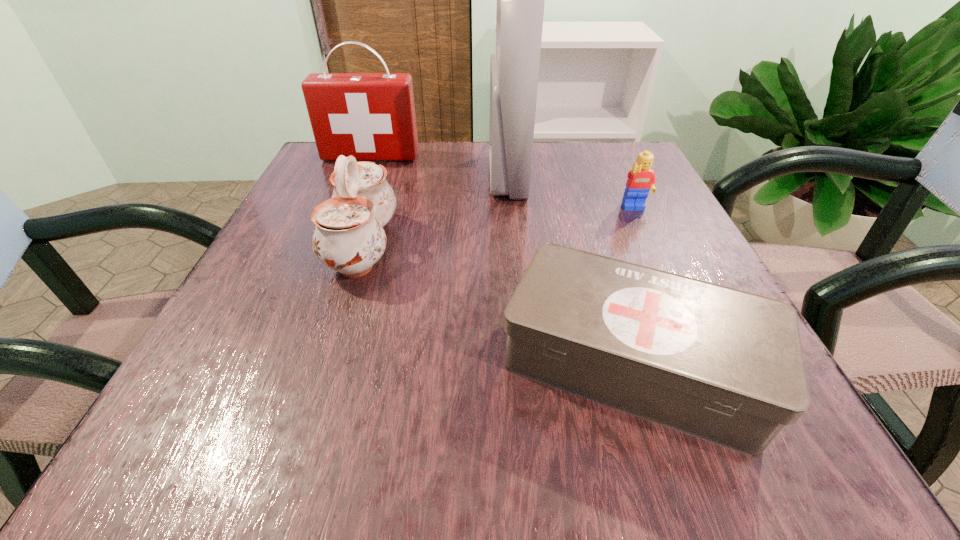
Find the location of a particular element. The image size is (960, 540). object positioned at the near right corner is located at coordinates (724, 365).

This screenshot has height=540, width=960. I want to click on vacant region at the far edge, so click(x=531, y=177).

Find the location of `vacant space at the near edge of the desktop`. vacant space at the near edge of the desktop is located at coordinates (323, 456).

Identify the location of free space at the left edge. tap(312, 200).

The image size is (960, 540). Find the location of `vacant area at the right edge`. vacant area at the right edge is located at coordinates (648, 212).

You are a GUI agent. You are given a task and a screenshot of the screen. Output one action in this format:
    pyautogui.click(x=<x>, y=<y>)
    Task: Click on the vacant region at the near left corner of the desktop
    Image resolution: width=960 pixels, height=540 pixels.
    Given the screenshot: What is the action you would take?
    pyautogui.click(x=276, y=429)

Identify the location of free space at the near right corner. Image resolution: width=960 pixels, height=540 pixels. (775, 448).

Find the location of a particular element. vacant space in between the tallest object and the leftmost first-aid kit is located at coordinates (439, 166).

You are a GUI agent. You are given a task and a screenshot of the screen. Output one action in this format:
    pyautogui.click(x=<x>, y=<y>)
    Task: Click on the vacant space that's between the nearest first-aid kit and the chinaware
    
    Given the screenshot: What is the action you would take?
    pyautogui.click(x=497, y=305)

Locate an element on the screen. blank region between the chinaware and the fourth tallest object is located at coordinates (499, 228).